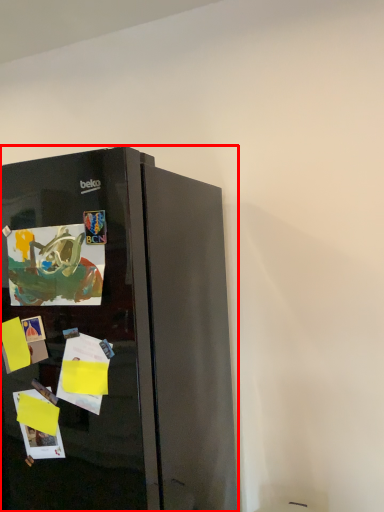
Question: In this image, where is refrigerator (annotated by the red box) located relative to postcard?

Choices:
 (A) left
 (B) right

Answer: (A)